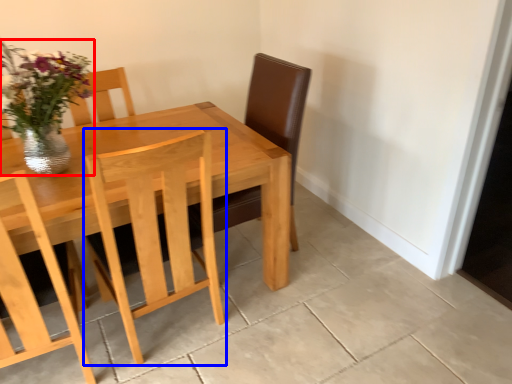
Question: Which object is further to the camera taking this photo, floral arrangement (highlighted by a red box) or chair (highlighted by a blue box)?

Choices:
 (A) floral arrangement
 (B) chair

Answer: (A)